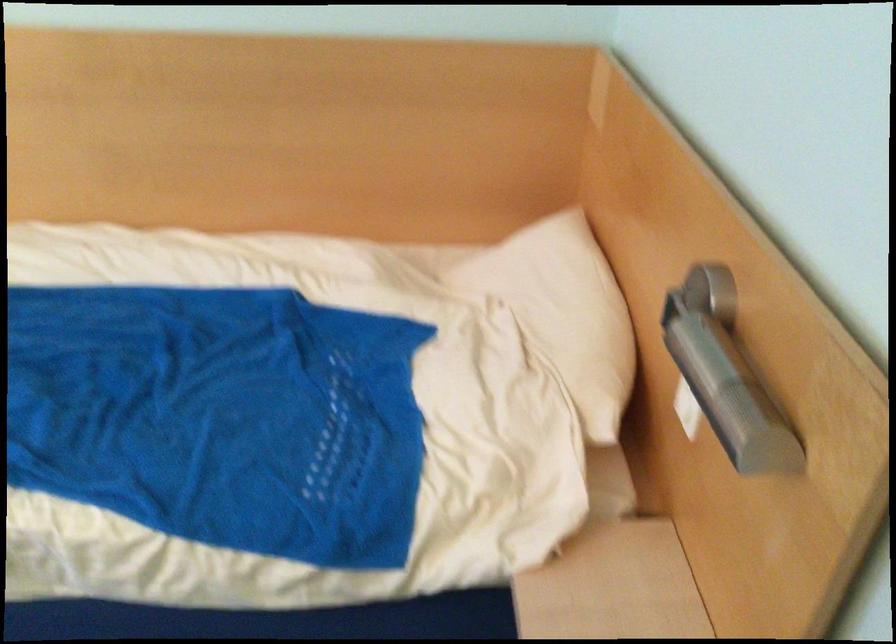
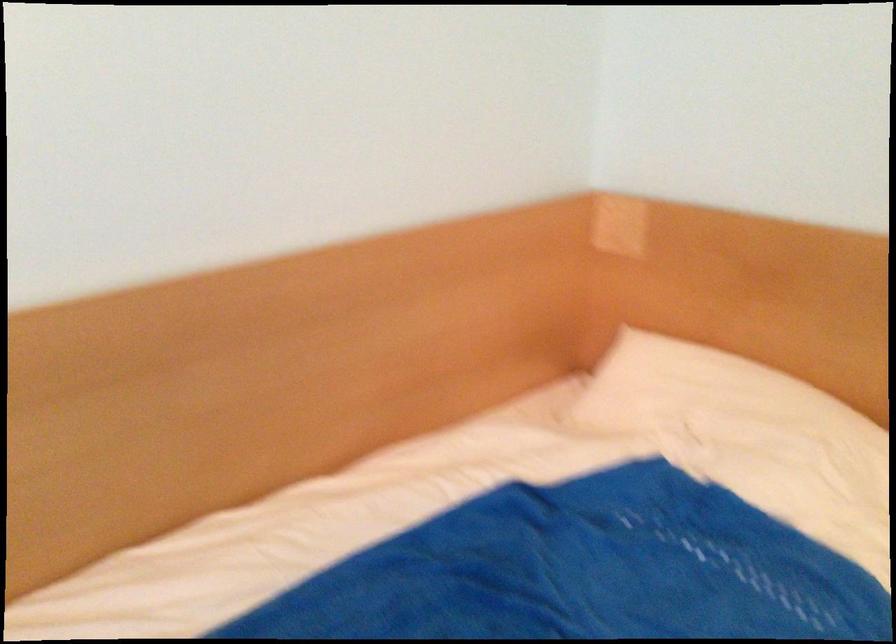
Locate, in the second image, the point that corresponds to point (521, 288) in the first image.

(707, 391)